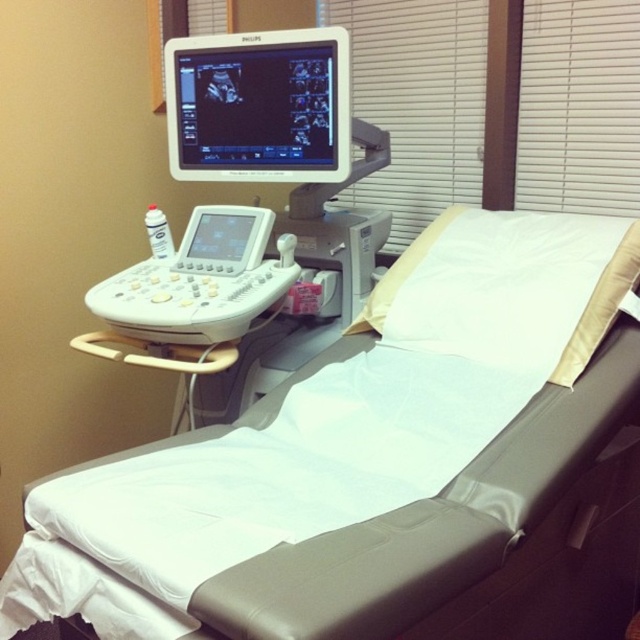
You are a medical technician entering the examination room and need to adjust the lighting. The room has a white plastic ultrasound machine at left and white plastic blinds at upper center. Which object should you interact with to control the amount of natural light entering the room?

The white plastic blinds at upper center is positioned over the white plastic ultrasound machine at left, so you should interact with the white plastic blinds at upper center to control the natural light entering the room.

You are a medical technician in the room. You need to move from the ultrasound machine on the left to the examination table on the right. There are two points marked in the room. One is at point (400, 145) and the other is at point (198, 296). Which point is closer to the examination table on the right?

Point (198, 296) is closer to the examination table on the right because it is in front of point (400, 145).

You are a nurse preparing to move a medical cart that is 1.2 meters wide between the white vinyl bed at center and the white plastic ultrasound machine at left. Based on the scene, can the cart fit through the space between them?

The white vinyl bed at center is wider than the white plastic ultrasound machine at left. Since the cart is 1.2 meters wide, the space between them may be sufficient if the total available width exceeds 1.2 meters. However, without exact measurements of the gap, it is uncertain. The nurse should measure the space before attempting to move the cart.